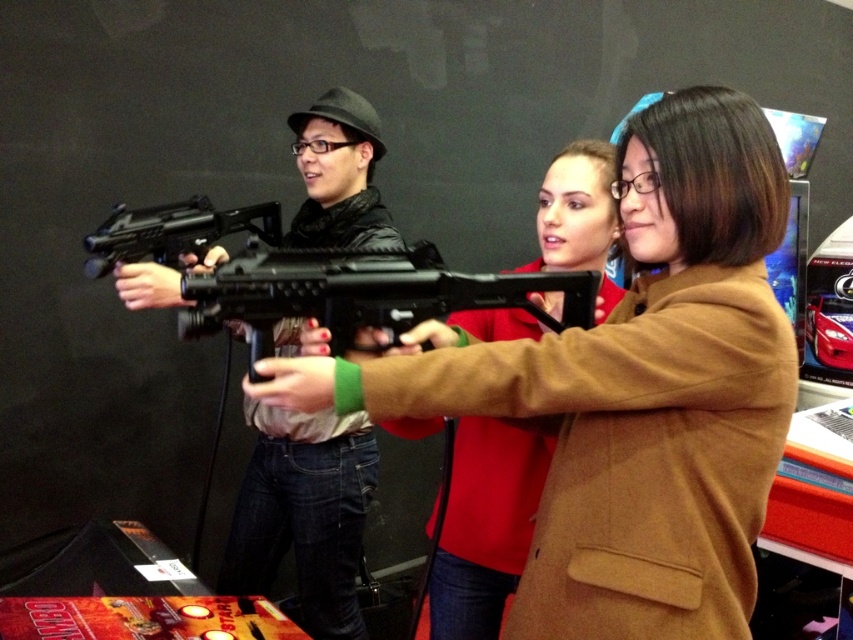
You are playing a VR game where you must shoot targets in order. There are two targets at point (523, 284) and point (225, 230). Which target should you shoot first if you need to shoot the one closer to you?

You should shoot the point (523, 284) first because it is in front of point (225, 230), making it closer to you.

You are a game organizer at the event. You need to retrieve both the matte black gun at center and the black plastic rifle at center for maintenance. Which one should you pick up first if you want to minimize bending over?

You should pick up the matte black gun at center first since the black plastic rifle at center is behind it, meaning the matte black gun is closer to you and requires less bending.